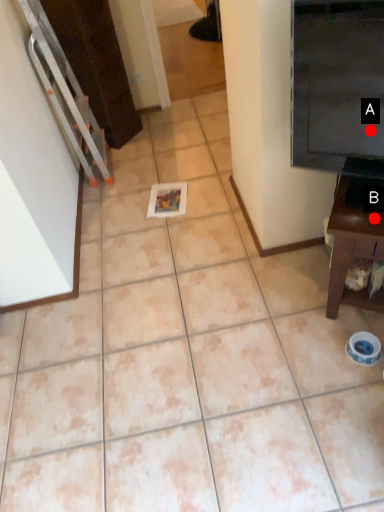
Question: Two points are circled on the image, labeled by A and B beside each circle. Which point appears farthest from the camera in this image?

Choices:
 (A) A is further
 (B) B is further

Answer: (B)